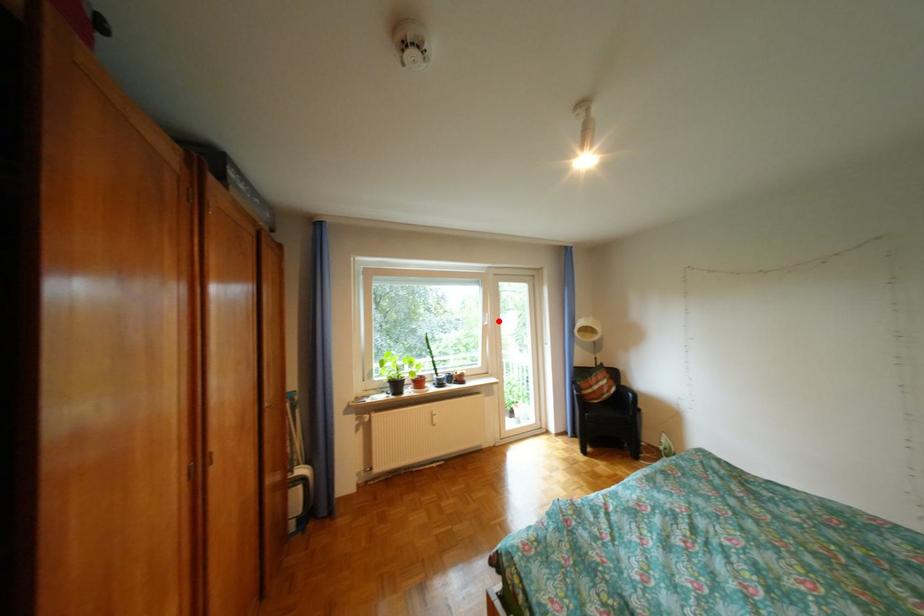
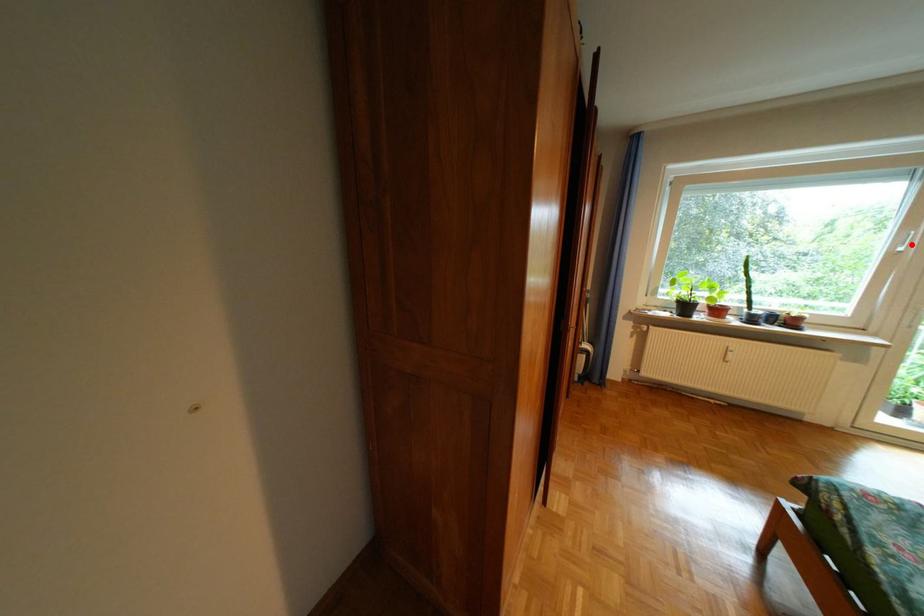
I am providing you with two images of the same scene from different viewpoints. A red point is marked on the first image and another point is marked on the second image. Do the highlighted points in image1 and image2 indicate the same real-world spot?

Yes